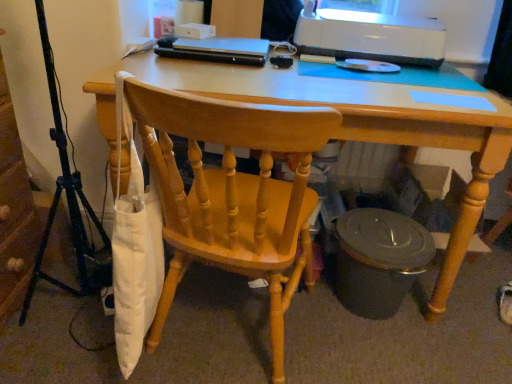
Find the location of a particular element. vacant space underneath wooden chair at center (from a real-world perspective) is located at coordinates (227, 342).